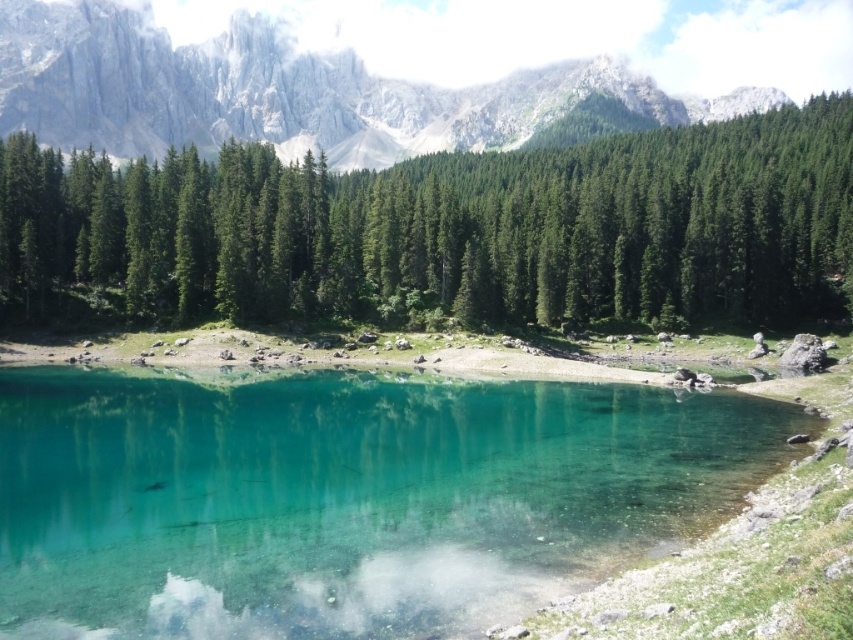
Question: Is clear glass water at center to the left of rugged stone mountain at upper center from the viewer's perspective?

Choices:
 (A) no
 (B) yes

Answer: (B)

Question: Which object is positioned closest to the clear glass water at center?

Choices:
 (A) green matte tree at center
 (B) rugged stone mountain at upper center

Answer: (A)

Question: Is green matte tree at center wider than rugged stone mountain at upper center?

Choices:
 (A) no
 (B) yes

Answer: (A)

Question: Which point is farther to the camera?

Choices:
 (A) (126, 122)
 (B) (321, 173)

Answer: (A)

Question: Does clear glass water at center have a smaller size compared to green matte tree at center?

Choices:
 (A) no
 (B) yes

Answer: (B)

Question: Estimate the real-world distances between objects in this image. Which object is farther from the rugged stone mountain at upper center?

Choices:
 (A) green matte tree at center
 (B) clear glass water at center

Answer: (B)